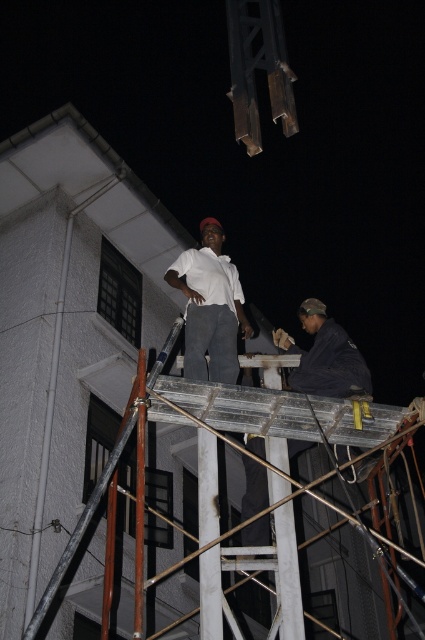
You are a safety inspector checking the construction site at night. You notice two workers wearing different colored clothing. The first worker has a white matte shirt at center and the second has a dark gray fabric at center. Which worker is wearing a wider piece of clothing?

The dark gray fabric at center is wider than the white matte shirt at center, so the second worker is wearing a wider piece of clothing.

You are a safety inspector standing at the base of the scaffolding. You need to ensure that the distance between the white matte shirt at center and the dark gray fabric at center meets the safety regulation of 5 feet minimum. Is the current distance compliant?

The white matte shirt at center is 6.77 feet away from the dark gray fabric at center, which exceeds the 5 feet minimum requirement. Therefore, the current distance is compliant with safety regulations.